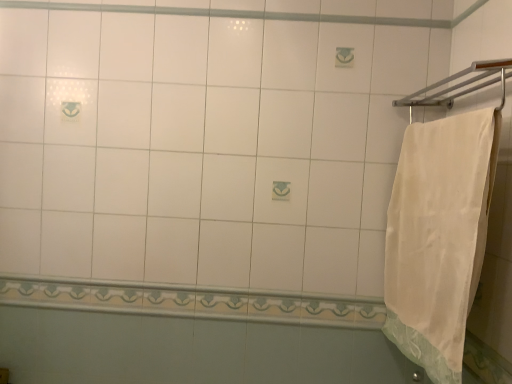
Question: Can you confirm if silver metallic towel bar at upper right is positioned to the left of white cotton towel at right?

Choices:
 (A) no
 (B) yes

Answer: (A)

Question: Does silver metallic towel bar at upper right turn towards white cotton towel at right?

Choices:
 (A) yes
 (B) no

Answer: (B)

Question: From the image's perspective, would you say silver metallic towel bar at upper right is positioned over white cotton towel at right?

Choices:
 (A) no
 (B) yes

Answer: (B)

Question: Is silver metallic towel bar at upper right directly adjacent to white cotton towel at right?

Choices:
 (A) yes
 (B) no

Answer: (B)

Question: Would you consider silver metallic towel bar at upper right to be distant from white cotton towel at right?

Choices:
 (A) no
 (B) yes

Answer: (A)

Question: In terms of width, does white cotton towel at right look wider or thinner when compared to silver metallic towel bar at upper right?

Choices:
 (A) wide
 (B) thin

Answer: (B)

Question: Considering the positions of white cotton towel at right and silver metallic towel bar at upper right in the image, is white cotton towel at right taller or shorter than silver metallic towel bar at upper right?

Choices:
 (A) short
 (B) tall

Answer: (B)

Question: Relative to silver metallic towel bar at upper right, is white cotton towel at right in front or behind?

Choices:
 (A) behind
 (B) front

Answer: (A)

Question: Which is correct: white cotton towel at right is inside silver metallic towel bar at upper right, or outside of it?

Choices:
 (A) inside
 (B) outside

Answer: (B)

Question: From the image's perspective, is silver metallic towel bar at upper right above or below white cotton towel at right?

Choices:
 (A) below
 (B) above

Answer: (B)

Question: Is silver metallic towel bar at upper right wider or thinner than white cotton towel at right?

Choices:
 (A) wide
 (B) thin

Answer: (A)

Question: Is silver metallic towel bar at upper right spatially inside white cotton towel at right, or outside of it?

Choices:
 (A) inside
 (B) outside

Answer: (B)

Question: In the image, is silver metallic towel bar at upper right positioned in front of or behind white cotton towel at right?

Choices:
 (A) behind
 (B) front

Answer: (B)

Question: Is silver metallic towel bar at upper right bigger or smaller than white glossy tile at lower center?

Choices:
 (A) small
 (B) big

Answer: (B)

Question: From a real-world perspective, is silver metallic towel bar at upper right physically located above or below white glossy tile at lower center?

Choices:
 (A) above
 (B) below

Answer: (A)